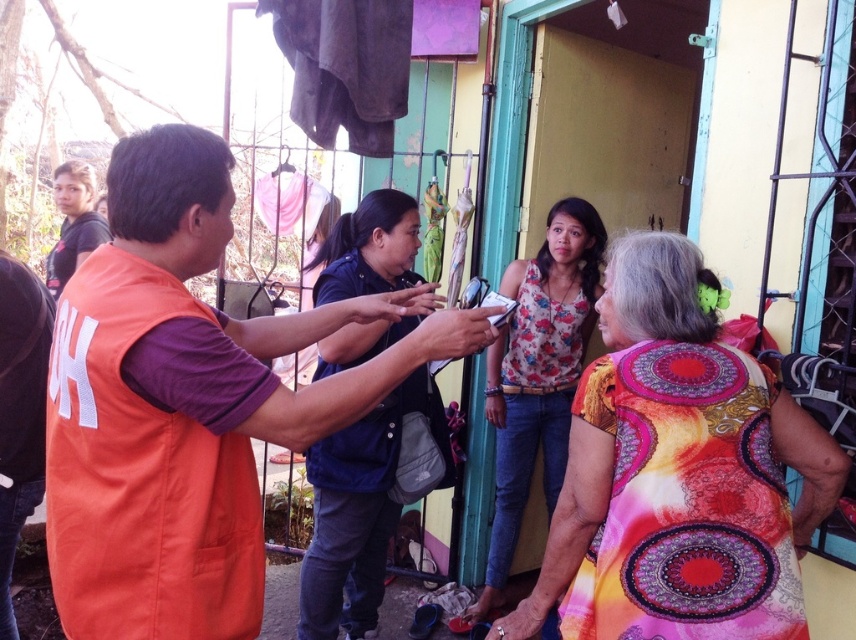
Question: Which object is closer to the camera taking this photo?

Choices:
 (A) smooth skin hand at center
 (B) matte black hand at center
 (C) orange fabric vest at left
 (D) printed fabric blouse at center

Answer: (C)

Question: Which point is farther to the camera?

Choices:
 (A) (764, 454)
 (B) (501, 410)

Answer: (B)

Question: Is dark blue denim jacket at center further to camera compared to matte black shirt at upper left?

Choices:
 (A) no
 (B) yes

Answer: (A)

Question: Estimate the real-world distances between objects in this image. Which object is farther from the matte black hand at center?

Choices:
 (A) matte pink hand at lower center
 (B) orange fabric vest at left
 (C) smooth leather bracelet at lower center

Answer: (C)

Question: Is smooth skin hand at center smaller than matte pink hand at lower center?

Choices:
 (A) yes
 (B) no

Answer: (B)

Question: Where is matte black hand at center located in relation to smooth leather bracelet at lower center in the image?

Choices:
 (A) right
 (B) left

Answer: (B)